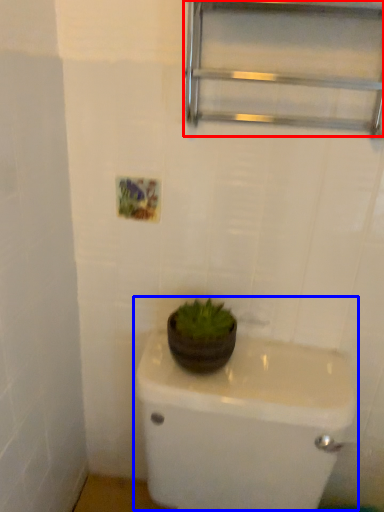
Question: Which of the following is the farthest to the observer, shelf (highlighted by a red box) or sink (highlighted by a blue box)?

Choices:
 (A) shelf
 (B) sink

Answer: (A)